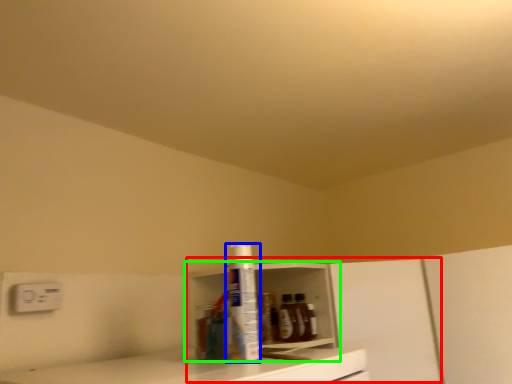
Question: Which object is positioned closest to cabinetry (highlighted by a red box)? Select from bottle (highlighted by a blue box) and shelf (highlighted by a green box).

Choices:
 (A) bottle
 (B) shelf

Answer: (B)